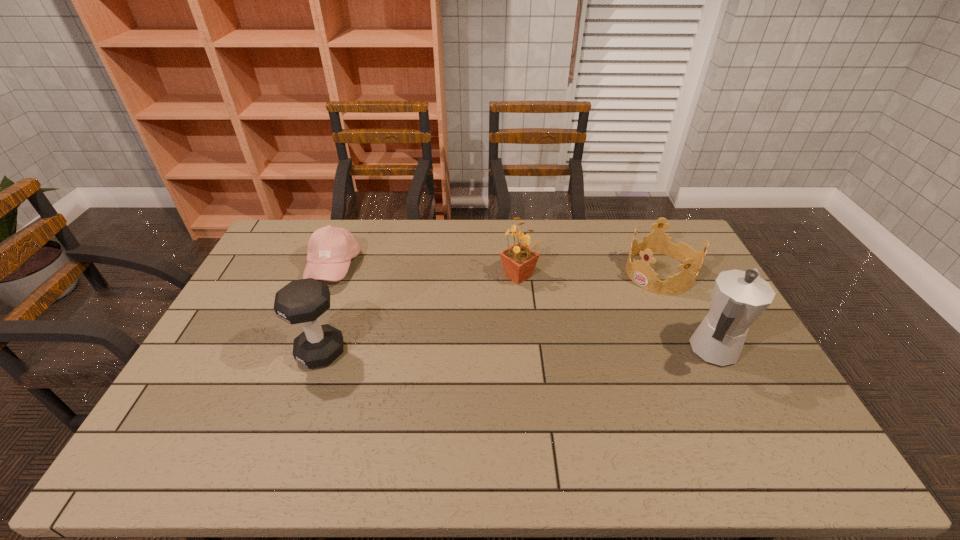
Where is `vacant space on the desktop that is between the dumbbell and the coffeepot and is positioned on the front-facing side of the baseball cap`? The image size is (960, 540). vacant space on the desktop that is between the dumbbell and the coffeepot and is positioned on the front-facing side of the baseball cap is located at coordinates (484, 352).

In order to click on vacant space on the desktop that is between the dumbbell and the tallest object and is positioned on the front-facing side of the tiara in this screenshot , I will do click(535, 352).

Find the location of `vacant spot on the desktop that is between the dumbbell and the tallest object and is positioned at the front of the sunflower with flowers visible`. vacant spot on the desktop that is between the dumbbell and the tallest object and is positioned at the front of the sunflower with flowers visible is located at coordinates (517, 352).